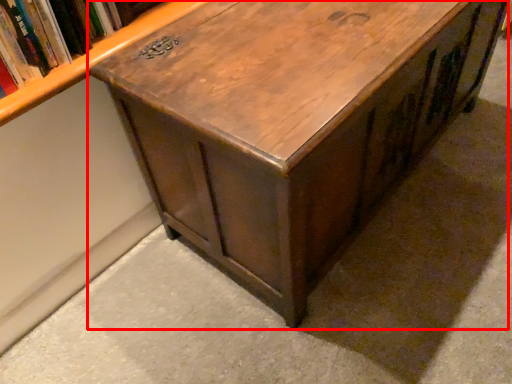
Question: Where is table (annotated by the red box) located in relation to book in the image?

Choices:
 (A) left
 (B) right

Answer: (B)